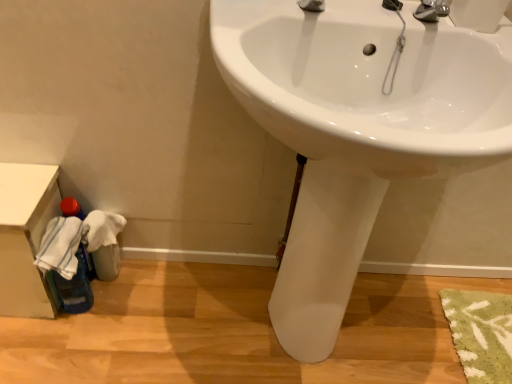
Where is `free space underneath white glossy sink at center (from a real-world perspective)`? Image resolution: width=512 pixels, height=384 pixels. free space underneath white glossy sink at center (from a real-world perspective) is located at coordinates (281, 339).